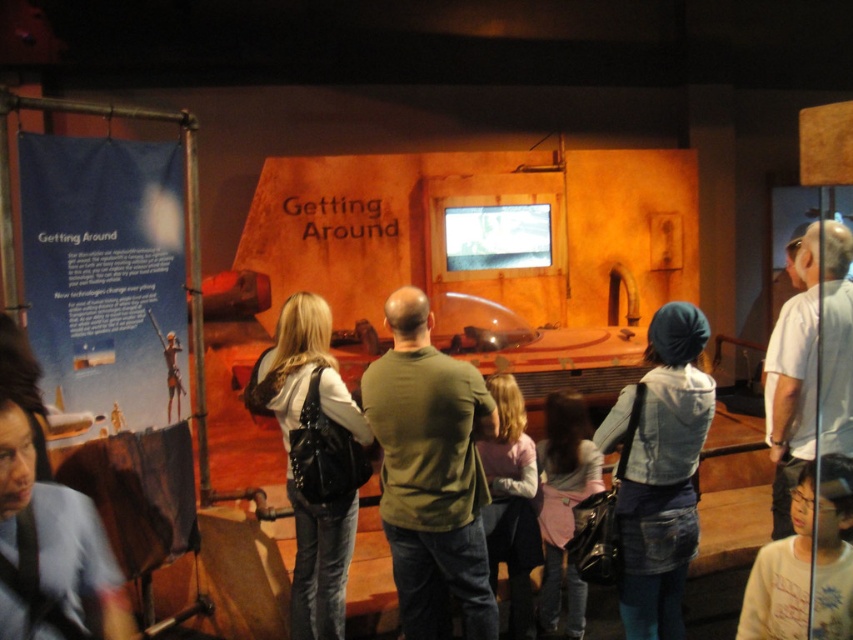
You are standing in the museum exhibit and notice two people in the crowd. One is wearing a green matte shirt at center and the other a gray fabric shirt at upper right. Which person is closer to you?

The green matte shirt at center is smaller than the gray fabric shirt at upper right, so the gray fabric shirt at upper right is closer to you because objects closer appear larger.